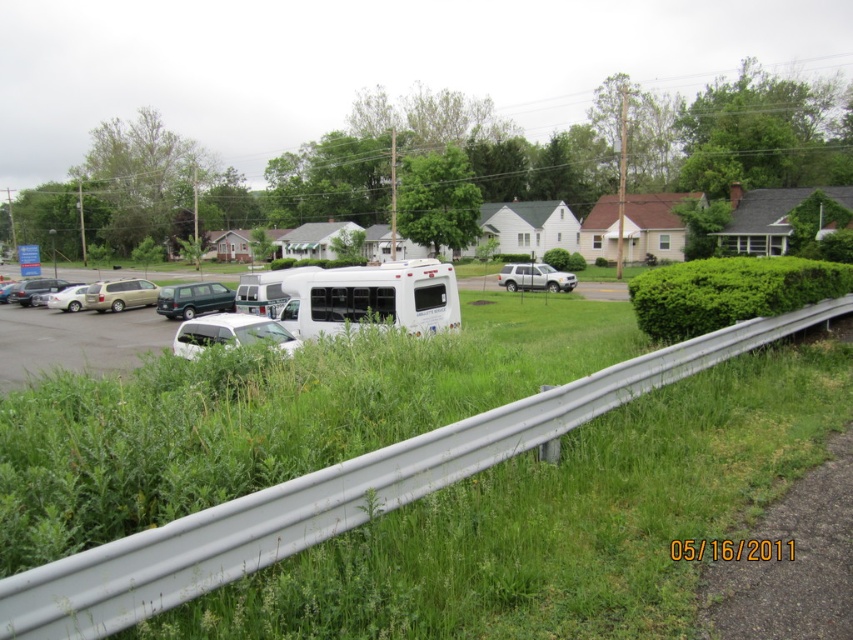
You are a delivery driver who needs to park your truck between the white matte car at center and the matte silver sedan at left. The truck is 12 meters long. Is there enough space between them to park your truck?

The distance between the white matte car at center and the matte silver sedan at left is 26.09 meters. Since the truck is 12 meters long, there is sufficient space to park between them.